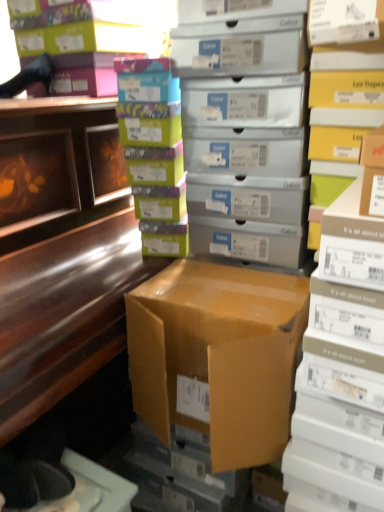
Question: From a real-world perspective, is matte silver shoebox at center, which appears as the first shelf when viewed from the left, under matte cardboard box at right, positioned as the second book in top-to-bottom order?

Choices:
 (A) no
 (B) yes

Answer: (A)

Question: Can you confirm if matte silver shoebox at center, positioned as the second shelf in right-to-left order, is shorter than matte cardboard box at right, marked as the first book in a bottom-to-top arrangement?

Choices:
 (A) yes
 (B) no

Answer: (A)

Question: Is matte silver shoebox at center, positioned as the second shelf in right-to-left order, smaller than matte cardboard box at right, the second book viewed from the left?

Choices:
 (A) yes
 (B) no

Answer: (A)

Question: Is matte silver shoebox at center, which appears as the first shelf when viewed from the left, not inside matte cardboard box at right, positioned as the second book in top-to-bottom order?

Choices:
 (A) no
 (B) yes

Answer: (B)

Question: Can you confirm if matte silver shoebox at center, which appears as the first shelf when viewed from the left, is thinner than matte cardboard box at right, marked as the first book in a bottom-to-top arrangement?

Choices:
 (A) no
 (B) yes

Answer: (B)

Question: Is matte silver shoebox at center, positioned as the second shelf in right-to-left order, facing towards matte cardboard box at right, the second book viewed from the left?

Choices:
 (A) yes
 (B) no

Answer: (B)

Question: Is multicolored cardboard boxes at center, positioned as the first book in left-to-right order, inside brown cardboard box at center?

Choices:
 (A) no
 (B) yes

Answer: (A)

Question: Does brown cardboard box at center have a greater height compared to multicolored cardboard boxes at center, marked as the second book in a bottom-to-top arrangement?

Choices:
 (A) no
 (B) yes

Answer: (A)

Question: From a real-world perspective, is brown cardboard box at center under multicolored cardboard boxes at center, the second book viewed from the right?

Choices:
 (A) yes
 (B) no

Answer: (A)

Question: Is multicolored cardboard boxes at center, positioned as the first book in left-to-right order, at the back of brown cardboard box at center?

Choices:
 (A) no
 (B) yes

Answer: (A)

Question: Does brown cardboard box at center have a lesser width compared to multicolored cardboard boxes at center, the second book viewed from the right?

Choices:
 (A) no
 (B) yes

Answer: (A)

Question: Considering the relative positions of brown cardboard box at center and multicolored cardboard boxes at center, the second book viewed from the right, in the image provided, is brown cardboard box at center to the left of multicolored cardboard boxes at center, the second book viewed from the right, from the viewer's perspective?

Choices:
 (A) no
 (B) yes

Answer: (A)

Question: From a real-world perspective, is shiny brown desk at left beneath matte silver shoebox at center, which appears as the first shelf when viewed from the left?

Choices:
 (A) no
 (B) yes

Answer: (B)